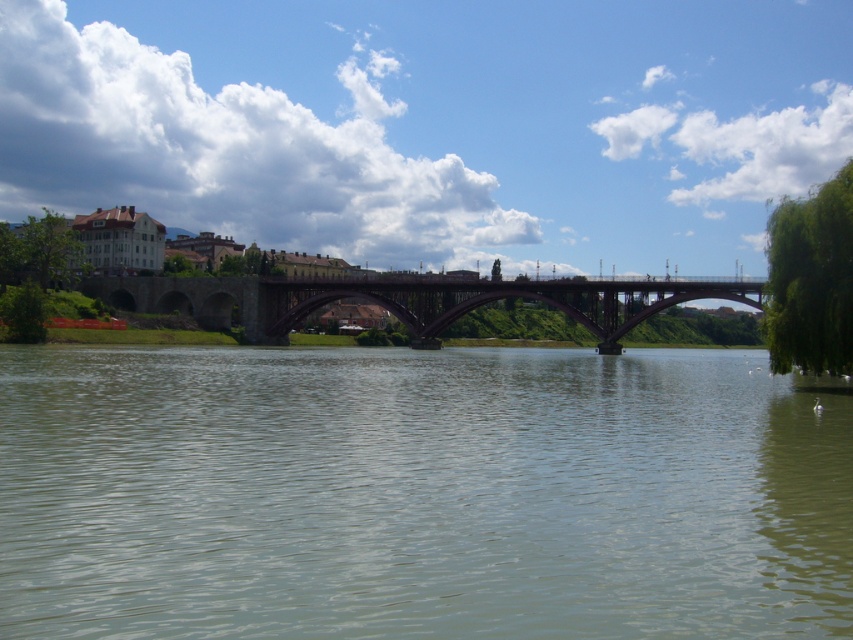
Question: Is greenish water at center thinner than dark brown stone bridge at center?

Choices:
 (A) yes
 (B) no

Answer: (A)

Question: Which of the following is the farthest from the observer?

Choices:
 (A) greenish water at center
 (B) dark brown stone bridge at center

Answer: (B)

Question: Which point is closer to the camera taking this photo?

Choices:
 (A) (300, 308)
 (B) (753, 522)

Answer: (B)

Question: Is greenish water at center to the left of dark brown stone bridge at center from the viewer's perspective?

Choices:
 (A) yes
 (B) no

Answer: (B)

Question: Can you confirm if greenish water at center is smaller than dark brown stone bridge at center?

Choices:
 (A) no
 (B) yes

Answer: (B)